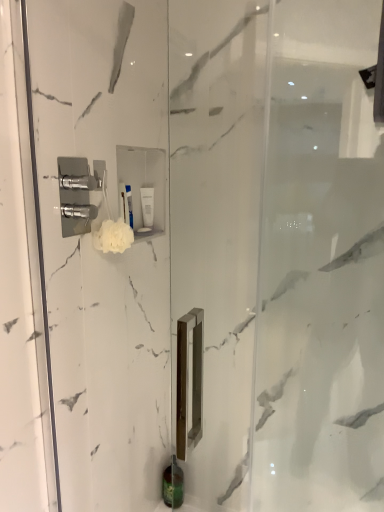
Question: In which direction should I rotate to look at white matte tube at upper center, placed as the 1th toiletry when sorted from top to bottom?

Choices:
 (A) right
 (B) left

Answer: (B)

Question: Is white matte tube at upper center, the 1th toiletry viewed from the left, completely or partially inside green matte bottle at lower center, the 1th toiletry in the bottom-to-top sequence?

Choices:
 (A) yes
 (B) no

Answer: (B)

Question: Considering the relative sizes of green matte bottle at lower center, which appears as the 2th toiletry when viewed from the top, and white matte tube at upper center, which is counted as the second toiletry, starting from the bottom, in the image provided, is green matte bottle at lower center, which appears as the 2th toiletry when viewed from the top, wider than white matte tube at upper center, which is counted as the second toiletry, starting from the bottom,?

Choices:
 (A) no
 (B) yes

Answer: (B)

Question: Is green matte bottle at lower center, arranged as the second toiletry when viewed from the front, bigger than white matte tube at upper center, which is the second toiletry in back-to-front order?

Choices:
 (A) yes
 (B) no

Answer: (A)

Question: Considering the relative sizes of green matte bottle at lower center, the 1th toiletry from the right, and white matte tube at upper center, placed as the 1th toiletry when sorted from top to bottom, in the image provided, is green matte bottle at lower center, the 1th toiletry from the right, shorter than white matte tube at upper center, placed as the 1th toiletry when sorted from top to bottom,?

Choices:
 (A) no
 (B) yes

Answer: (B)

Question: Does green matte bottle at lower center, arranged as the second toiletry when viewed from the front, appear on the right side of white matte tube at upper center, which is counted as the second toiletry, starting from the bottom?

Choices:
 (A) yes
 (B) no

Answer: (A)

Question: Is green matte bottle at lower center, arranged as the second toiletry when viewed from the front, smaller than white matte tube at upper center, the first toiletry in the front-to-back sequence?

Choices:
 (A) yes
 (B) no

Answer: (B)

Question: Is there a large distance between white fluffy sponge at upper center and white matte tube at upper center, which is counted as the second toiletry, starting from the bottom?

Choices:
 (A) no
 (B) yes

Answer: (A)

Question: Is white fluffy sponge at upper center not within white matte tube at upper center, which is counted as the second toiletry, starting from the bottom?

Choices:
 (A) yes
 (B) no

Answer: (A)

Question: From the image's perspective, is white fluffy sponge at upper center under white matte tube at upper center, placed as the 1th toiletry when sorted from top to bottom?

Choices:
 (A) yes
 (B) no

Answer: (A)

Question: Is white fluffy sponge at upper center thinner than white matte tube at upper center, the 1th toiletry viewed from the left?

Choices:
 (A) yes
 (B) no

Answer: (B)

Question: Is white fluffy sponge at upper center in front of white matte tube at upper center, the 1th toiletry viewed from the left?

Choices:
 (A) yes
 (B) no

Answer: (A)

Question: Is white matte tube at upper center, which is counted as the second toiletry, starting from the bottom, a part of white fluffy sponge at upper center?

Choices:
 (A) yes
 (B) no

Answer: (B)

Question: Considering the relative sizes of green matte bottle at lower center, which appears as the 2th toiletry when viewed from the top, and white fluffy sponge at upper center in the image provided, is green matte bottle at lower center, which appears as the 2th toiletry when viewed from the top, smaller than white fluffy sponge at upper center?

Choices:
 (A) no
 (B) yes

Answer: (A)